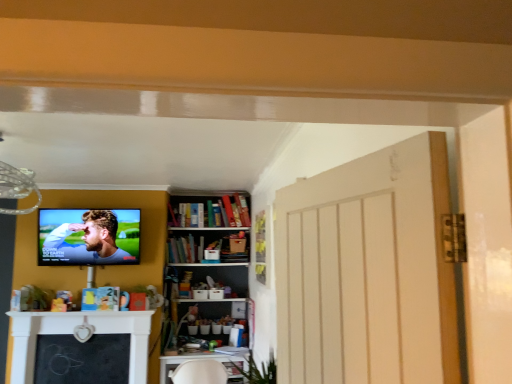
Find the location of a particular element. white plastic table at lower center is located at coordinates (193, 359).

Describe the element at coordinates (193, 359) in the screenshot. I see `white plastic table at lower center` at that location.

The height and width of the screenshot is (384, 512). In order to click on matte black tv at upper left in this screenshot , I will do `click(88, 241)`.

The height and width of the screenshot is (384, 512). Identify the location of hardcover books at center. (184, 249).

This screenshot has width=512, height=384. What are the coordinates of `book below the matte black tv at upper left (from a real-world perspective)` in the screenshot? It's located at (184, 249).

Is hardcover books at center facing towards matte black tv at upper left?

No, hardcover books at center does not turn towards matte black tv at upper left.

How distant is hardcover books at center from matte black tv at upper left?

A distance of 33.10 inches exists between hardcover books at center and matte black tv at upper left.

Would you say hardcover books at center is inside or outside matte black tv at upper left?

hardcover books at center is not inside matte black tv at upper left, it's outside.

Is point (211, 356) closer or farther from the camera than point (181, 245)?

Point (211, 356) is closer to the camera than point (181, 245).

Is white plastic table at lower center beside hardcover books at center?

There is a gap between white plastic table at lower center and hardcover books at center.

Is white plastic table at lower center aimed at hardcover books at center?

No, white plastic table at lower center is not facing towards hardcover books at center.

Considering the points (136, 260) and (169, 249), which point is behind, point (136, 260) or point (169, 249)?

The point (169, 249) is farther.

Is matte black tv at upper left positioned beyond the bounds of hardcover books at center?

Yes, matte black tv at upper left is outside of hardcover books at center.

From the image's perspective, is matte black tv at upper left located beneath hardcover books at center?

Incorrect, from the image's perspective, matte black tv at upper left is higher than hardcover books at center.

Considering the sizes of objects matte black tv at upper left and hardcover books at center in the image provided, who is taller, matte black tv at upper left or hardcover books at center?

With more height is matte black tv at upper left.

Considering the positions of objects matte black tv at upper left and white plastic table at lower center in the image provided, who is behind, matte black tv at upper left or white plastic table at lower center?

white plastic table at lower center is further from the camera.

From the picture: What's the angular difference between matte black tv at upper left and white plastic table at lower center's facing directions?

There is a 4.82e-05-degree angle between the facing directions of matte black tv at upper left and white plastic table at lower center.

Is matte black tv at upper left with white plastic table at lower center?

matte black tv at upper left is not next to white plastic table at lower center, and they're not touching.

Looking at this image, can you confirm if white plastic table at lower center is thinner than matte black tv at upper left?

No.

Is white plastic table at lower center oriented towards matte black tv at upper left?

No, white plastic table at lower center is not turned towards matte black tv at upper left.

Looking at this image, considering the relative positions of white plastic table at lower center and matte black tv at upper left in the image provided, is white plastic table at lower center to the right of matte black tv at upper left from the viewer's perspective?

Indeed, white plastic table at lower center is positioned on the right side of matte black tv at upper left.

From a real-world perspective, is white plastic table at lower center positioned above or below matte black tv at upper left?

From a real-world perspective, white plastic table at lower center is physically below matte black tv at upper left.

Would you consider hardcover books at center to be distant from white plastic table at lower center?

Yes, hardcover books at center is far from white plastic table at lower center.

From the picture: Is hardcover books at center aimed at white plastic table at lower center?

No, hardcover books at center is not aimed at white plastic table at lower center.

Considering the sizes of hardcover books at center and white plastic table at lower center in the image, is hardcover books at center taller or shorter than white plastic table at lower center?

hardcover books at center is shorter than white plastic table at lower center.

At what (x,y) coordinates should I click in order to perform the action: click on person in front of the hardcover books at center. Please return your answer as a coordinate pair (x, y). The width and height of the screenshot is (512, 384). Looking at the image, I should click on (88, 241).

In the image, there is a white plastic table at lower center. Identify the location of book above it (from the image's perspective). (184, 249).

Estimate the real-world distances between objects in this image. Which object is further from white plastic table at lower center, matte black tv at upper left or hardcover books at center?

Based on the image, matte black tv at upper left appears to be further to white plastic table at lower center.

Estimate the real-world distances between objects in this image. Which object is closer to matte black tv at upper left, white plastic table at lower center or hardcover books at center?

hardcover books at center is positioned closer to the anchor matte black tv at upper left.

Considering their positions, is matte black tv at upper left positioned closer to hardcover books at center than white plastic table at lower center?

matte black tv at upper left.

Looking at the image, which one is located further to matte black tv at upper left, hardcover books at center or white plastic table at lower center?

Among the two, white plastic table at lower center is located further to matte black tv at upper left.

Estimate the real-world distances between objects in this image. Which object is further from hardcover books at center, white plastic table at lower center or matte black tv at upper left?

Based on the image, white plastic table at lower center appears to be further to hardcover books at center.

From the image, which object appears to be nearer to white plastic table at lower center, hardcover books at center or matte black tv at upper left?

The object closer to white plastic table at lower center is hardcover books at center.

Locate an element on the screen. The width and height of the screenshot is (512, 384). book between matte black tv at upper left and white plastic table at lower center vertically is located at coordinates (184, 249).